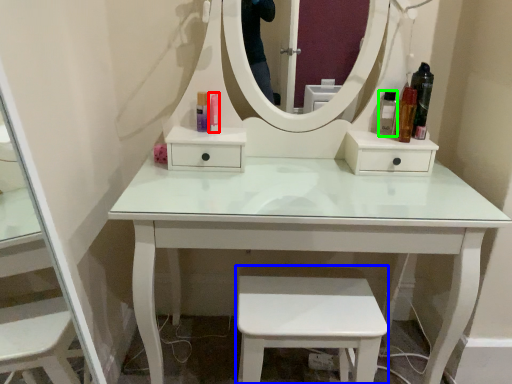
Question: Estimate the real-world distances between objects in this image. Which object is farther from toiletry (highlighted by a red box), step stool (highlighted by a blue box) or toiletry (highlighted by a green box)?

Choices:
 (A) step stool
 (B) toiletry

Answer: (A)